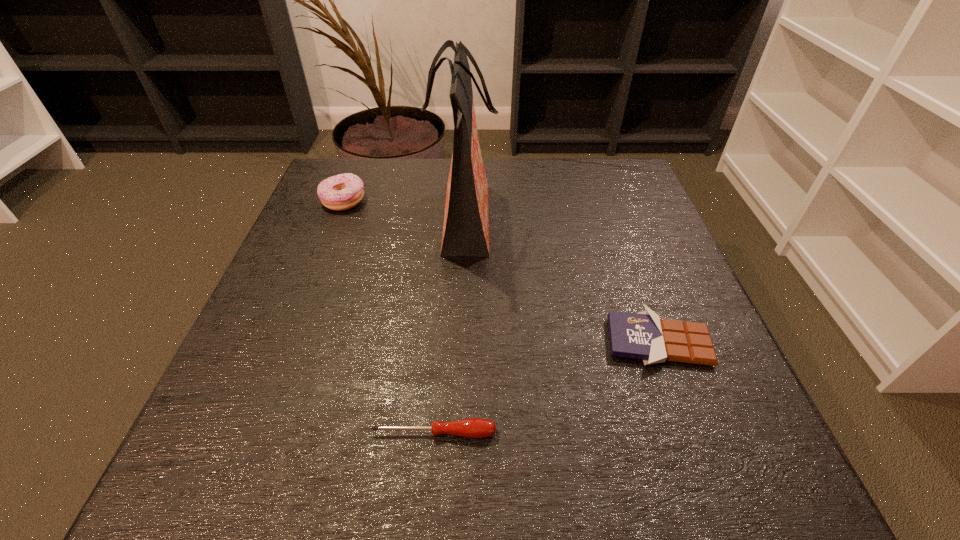
The width and height of the screenshot is (960, 540). I want to click on shopping bag positioned at the far edge, so (466, 219).

What are the coordinates of `doughnut located in the far edge section of the desktop` in the screenshot? It's located at (340, 192).

The image size is (960, 540). Identify the location of object at the near edge. (473, 427).

This screenshot has width=960, height=540. I want to click on object present at the left edge, so click(340, 192).

You are a GUI agent. You are given a task and a screenshot of the screen. Output one action in this format:
    pyautogui.click(x=<x>, y=<y>)
    Task: Click on the object positioned at the right edge
    The width and height of the screenshot is (960, 540).
    Given the screenshot: What is the action you would take?
    pyautogui.click(x=642, y=335)

Where is `object at the far left corner`? This screenshot has width=960, height=540. object at the far left corner is located at coordinates (340, 192).

In the image, there is a desktop. Where is `vacant space at the far edge`? This screenshot has width=960, height=540. vacant space at the far edge is located at coordinates (425, 189).

Locate an element on the screen. vacant space at the left edge of the desktop is located at coordinates (252, 345).

At what (x,y) coordinates should I click in order to perform the action: click on vacant region at the right edge of the desktop. Please return your answer as a coordinate pair (x, y). Looking at the image, I should click on (623, 244).

The image size is (960, 540). I want to click on free spot at the far left corner of the desktop, so click(335, 165).